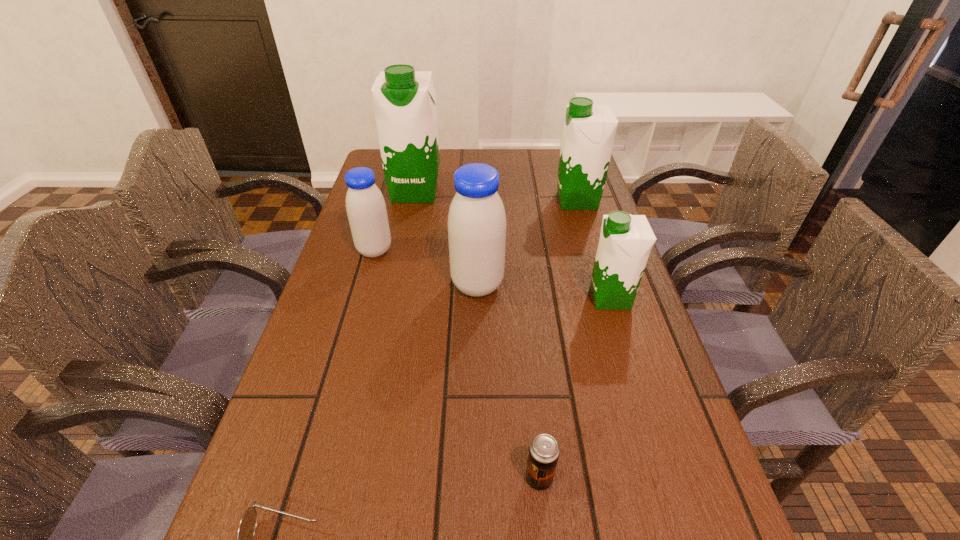
Image resolution: width=960 pixels, height=540 pixels. I want to click on object located in the far edge section of the desktop, so click(404, 100).

Where is `object located at the far left corner`? The image size is (960, 540). object located at the far left corner is located at coordinates (404, 100).

Locate an element on the screen. free region at the far edge of the desktop is located at coordinates (516, 154).

Identify the location of vacant space at the left edge. (313, 501).

This screenshot has height=540, width=960. Find the location of `blank space at the right edge of the desktop`. blank space at the right edge of the desktop is located at coordinates (607, 315).

Image resolution: width=960 pixels, height=540 pixels. What are the coordinates of `vacant area between the tallest object and the right blue soya milk` in the screenshot? It's located at coord(446,238).

The height and width of the screenshot is (540, 960). Identify the location of vacant space that's between the tallest soya milk and the smaller blue soya milk. (395, 221).

Where is `free space between the nearer blue soya milk and the nearest green soya milk`? The width and height of the screenshot is (960, 540). free space between the nearer blue soya milk and the nearest green soya milk is located at coordinates (544, 291).

The width and height of the screenshot is (960, 540). In order to click on vacant space that's between the smallest green soya milk and the fourth object from left to right in this screenshot , I will do `click(544, 291)`.

Find the location of a particular element. This screenshot has width=960, height=540. empty location between the fourth object from right to left and the second smallest green soya milk is located at coordinates (527, 243).